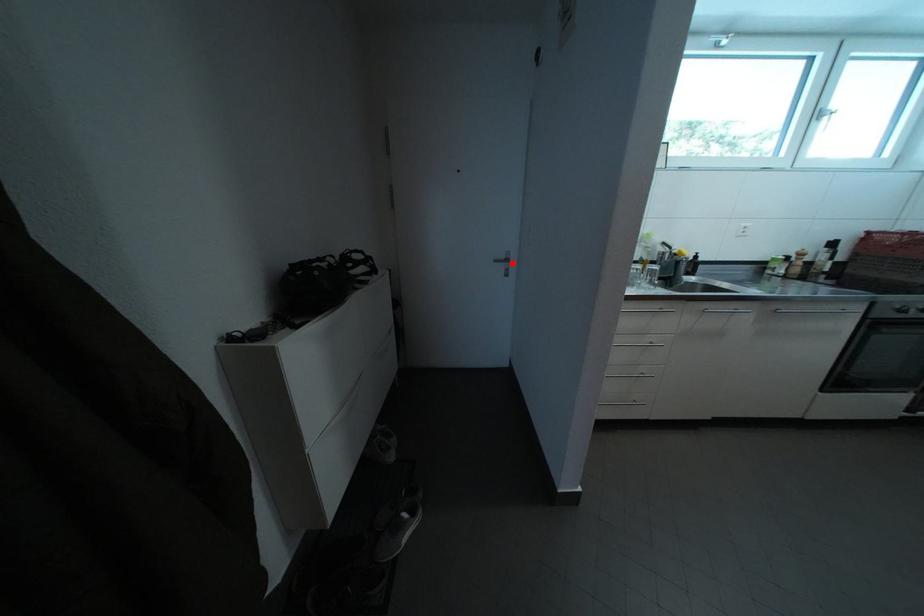
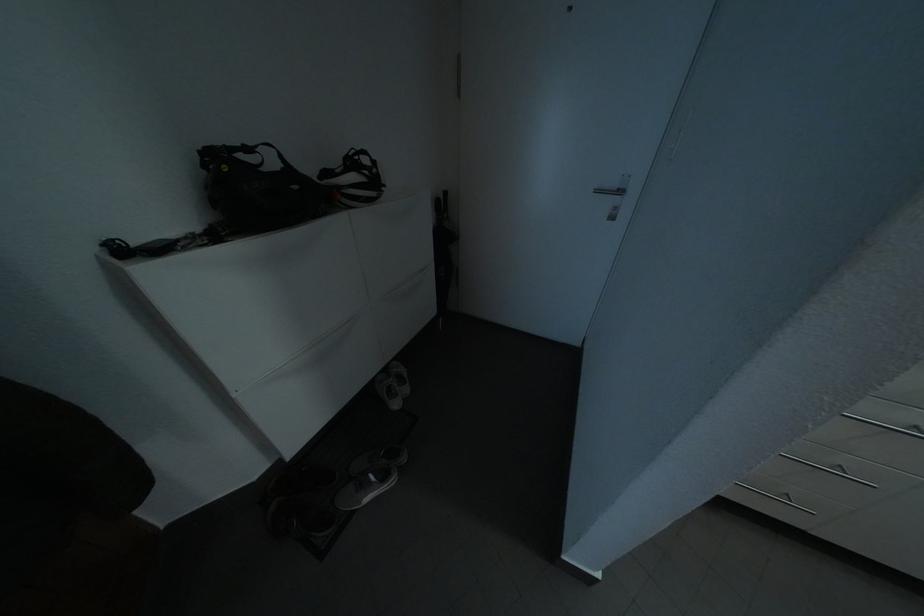
Question: I am providing you with two images of the same scene from different viewpoints. Image1 has a red point marked. In image2, the corresponding 3D location appears at what relative position? Reply with the corresponding letter.

Choices:
 (A) Closer
 (B) Farther

Answer: (B)